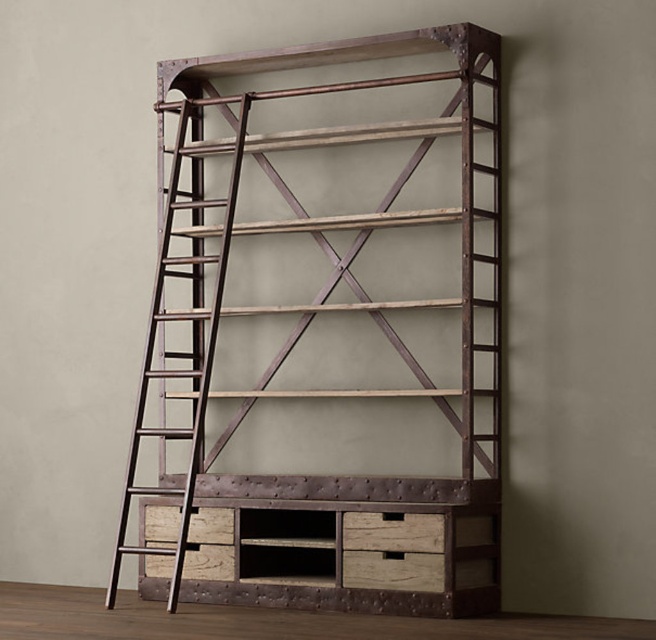
You are standing in front of the industrial shelving unit and notice a point at coordinates (x=344, y=544). What object is located at that position?

The point at coordinates (x=344, y=544) corresponds to the rustic wood crate at center.

You are organizing books in the image and need to place a large box. The box is too heavy to lift over the rustic wood bookshelf at center. Can you access the rustic wood crate at center without moving the bookshelf?

The rustic wood crate at center is behind the rustic wood bookshelf at center, so you can access it by going around the front of the rustic wood bookshelf at center and reaching the crate from the back side.

You are standing in front of the industrial shelving unit and need to reach a point marked at coordinates [251,525]. If your arm can extend 5 feet, can you reach that point without moving closer?

The point at coordinates [251,525] is 16.38 feet away from the camera. Since your arm can only extend 5 feet, you cannot reach that point without moving closer.